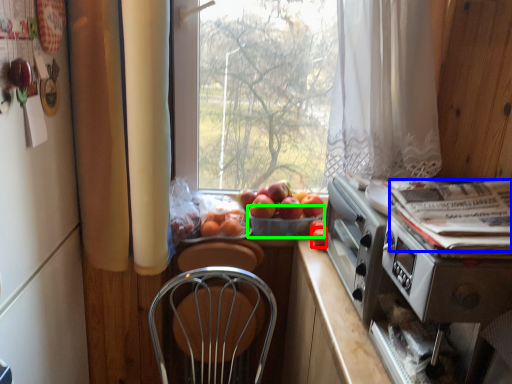
Question: Which is farther away from fruit (highlighted by a red box)? magazine (highlighted by a blue box) or basket (highlighted by a green box)?

Choices:
 (A) magazine
 (B) basket

Answer: (A)